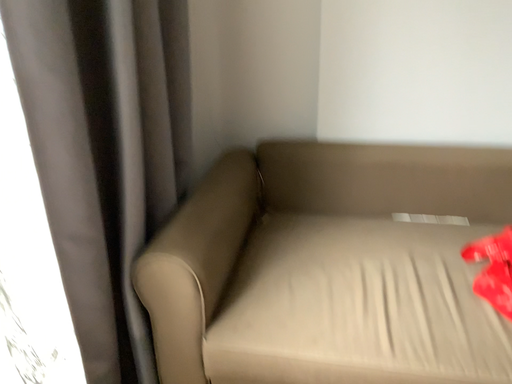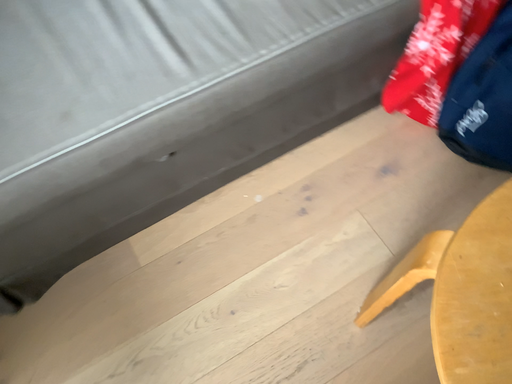
Question: How did the camera likely rotate when shooting the video?

Choices:
 (A) rotated left
 (B) rotated right

Answer: (B)